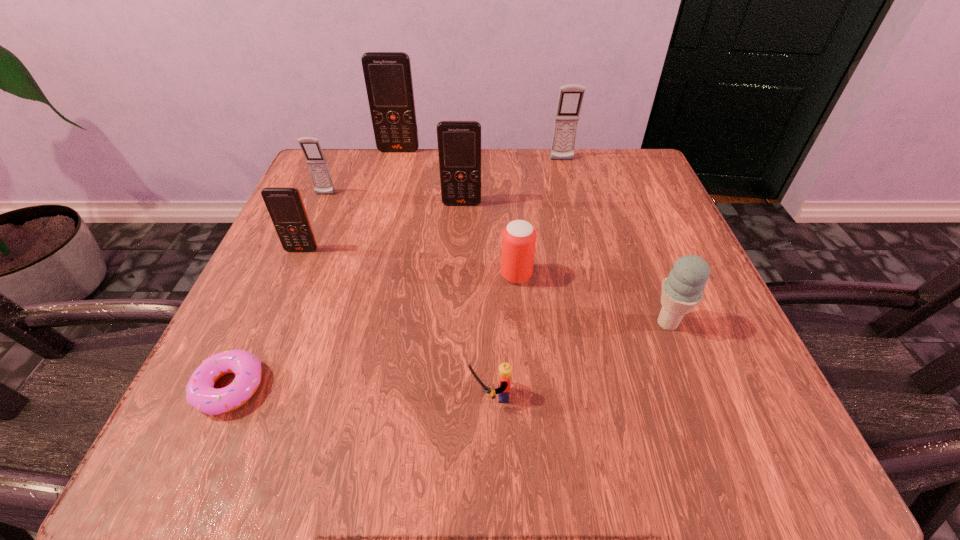
Identify the location of doughnut that is at the left edge. (200, 393).

At what (x,y) coordinates should I click in order to perform the action: click on object at the right edge. Please return your answer as a coordinate pair (x, y). This screenshot has width=960, height=540. Looking at the image, I should click on (682, 290).

Identify the location of object present at the near left corner. (200, 393).

Where is `vacant point at the far edge`? vacant point at the far edge is located at coordinates (563, 201).

The image size is (960, 540). Identify the location of vacant area at the near edge. (306, 432).

The image size is (960, 540). In order to click on free space at the left edge of the desktop in this screenshot , I will do `click(324, 321)`.

I want to click on vacant region at the right edge of the desktop, so click(x=638, y=345).

Find the location of a particular element. vacant area at the far right corner is located at coordinates [645, 190].

In the image, there is a desktop. What are the coordinates of `vacant region at the near right corner` in the screenshot? It's located at tap(736, 406).

At what (x,y) coordinates should I click in order to perform the action: click on free space between the blue ice cream and the right gray cellular telephone. Please return your answer as a coordinate pair (x, y). The height and width of the screenshot is (540, 960). Looking at the image, I should click on (614, 241).